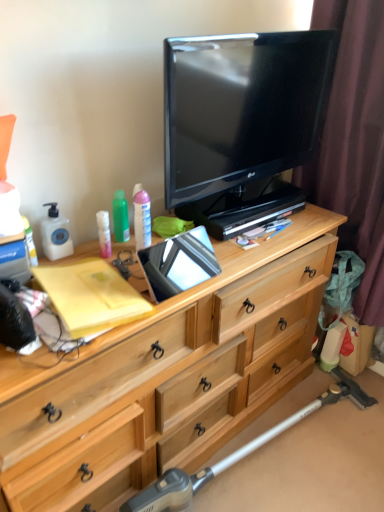
In order to click on vacant region to the left of green plastic bottle at upper left, which appears as the 2th toiletry when viewed from the left in this screenshot , I will do `click(86, 246)`.